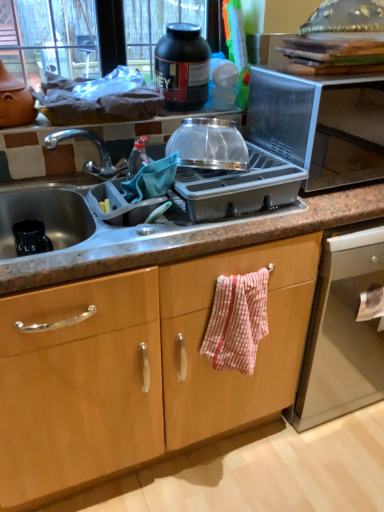
Locate an element on the screen. The image size is (384, 512). free space to the right of transparent plastic bowl at upper center, which is the first kitchen appliance from front to back is located at coordinates (275, 168).